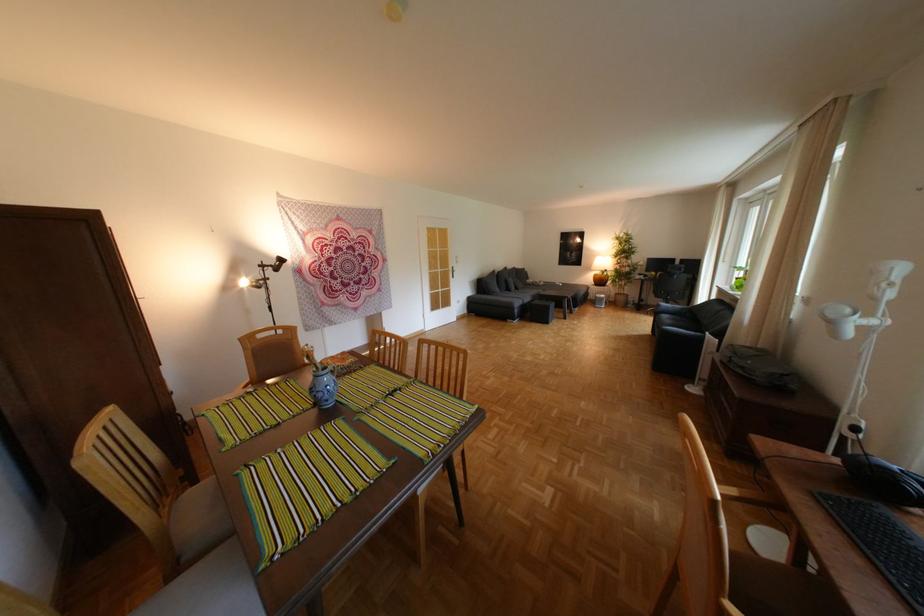
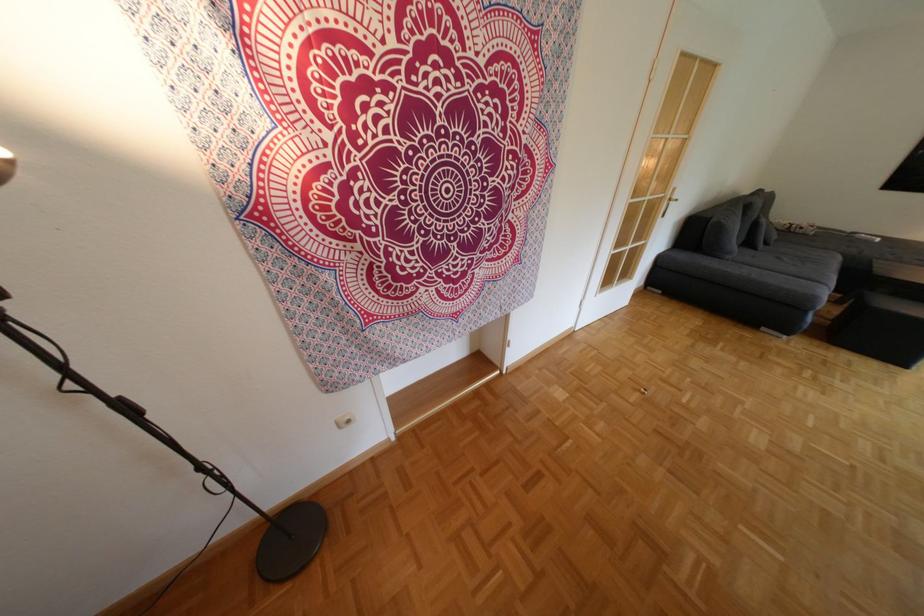
What movement of the cameraman would produce the second image?

The cameraman moved toward left, forward.